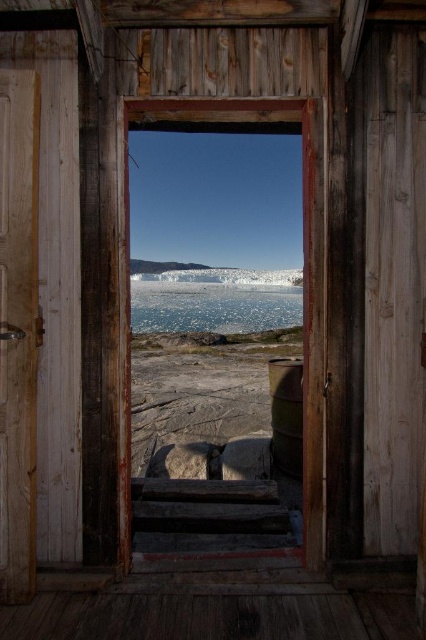
You are standing in a cabin and want to exit through the wooden door at left. However, there is translucent ice at center blocking your path. Can you walk straight through the doorway without moving the ice?

The wooden door at left is positioned under translucent ice at center, so the ice is above the door. You can walk straight through the wooden door at left since the ice is not blocking the doorway itself.

You are an architect designing a new ecofriendly building and want to ensure that the transparent glass window at center and the translucent ice at center are both visible from the main entrance. Given their thickness, which object might require additional lighting to be seen clearly?

The transparent glass window at center is thinner than the translucent ice at center, so the translucent ice at center may require additional lighting to be seen clearly because thicker materials often need more light to maintain visibility.

You are an architect designing a new entrance for a winter retreat. You have two materials to choose from for the door and the central feature of the entranceway. The wooden door at left and the translucent ice at center. Based on the scene, which material would you choose for the central feature to ensure it stands out visually compared to the door?

The translucent ice at center is larger than the wooden door at left, so choosing it for the central feature would make it stand out visually compared to the door.